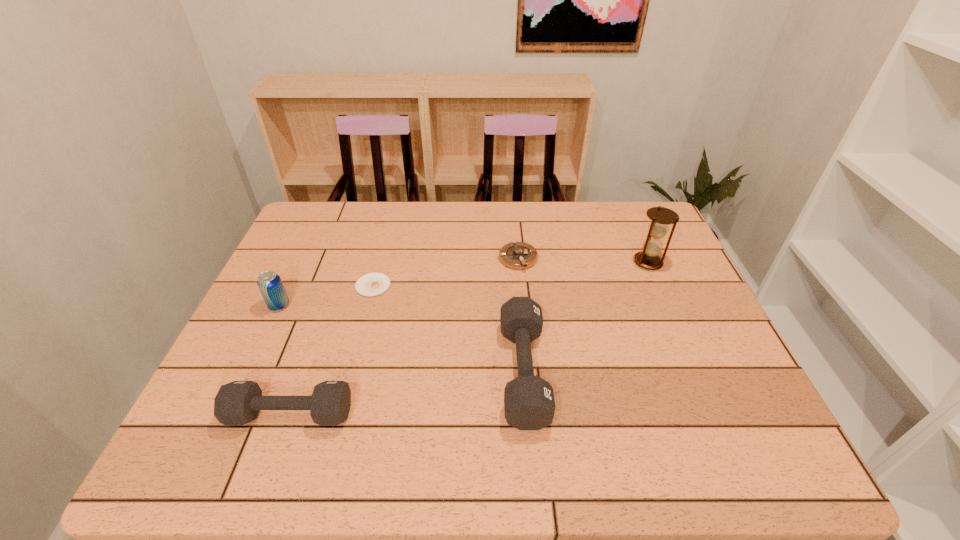
Where is `vacant space in between the right dumbbell and the fourth tallest object`? vacant space in between the right dumbbell and the fourth tallest object is located at coordinates (407, 393).

This screenshot has height=540, width=960. What are the coordinates of `vacant space that is in between the shortest object and the ashtray` in the screenshot? It's located at (445, 272).

Locate an element on the screen. vacant region between the tallest object and the egg yolk is located at coordinates (511, 274).

The height and width of the screenshot is (540, 960). I want to click on object that is the third closest to the left dumbbell, so click(529, 404).

Choose which object is the fourth nearest neighbor to the third shortest object. Please provide its 2D coordinates. Your answer should be formatted as a tuple, i.e. [(x, y)], where the tuple contains the x and y coordinates of a point satisfying the conditions above.

[(520, 255)]

Locate an element on the screen. free spot that satisfies the following two spatial constraints: 1. on the back side of the beer can; 2. on the right side of the egg yolk is located at coordinates (289, 286).

Locate an element on the screen. The width and height of the screenshot is (960, 540). free point that satisfies the following two spatial constraints: 1. on the back side of the tallest object; 2. on the left side of the taller dumbbell is located at coordinates (514, 262).